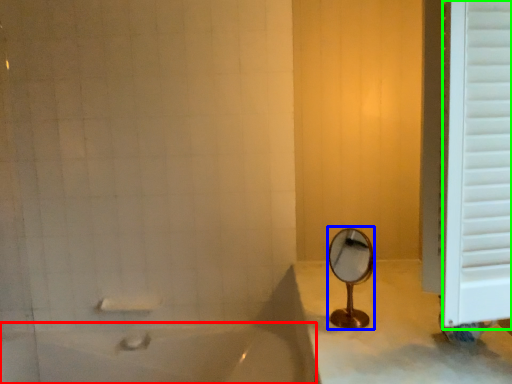
Question: Which is nearer to the bathtub (highlighted by a red box)? mirror (highlighted by a blue box) or window frame (highlighted by a green box).

Choices:
 (A) mirror
 (B) window frame

Answer: (A)